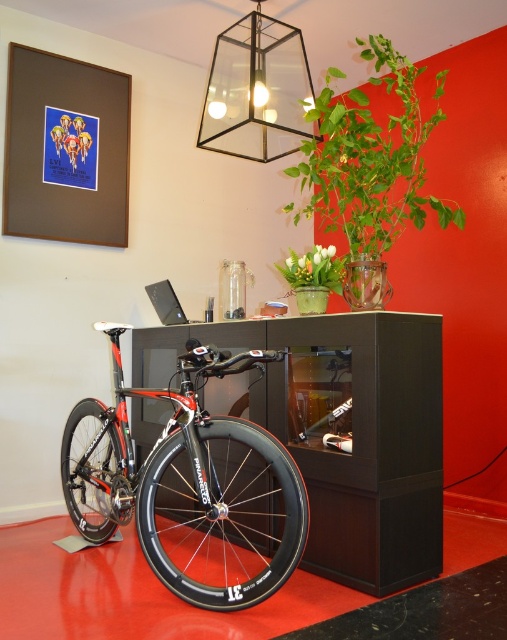
Question: Estimate the real-world distances between objects in this image. Which object is farther from the clear glass pendant light at upper center?

Choices:
 (A) satin black laptop at center
 (B) green matte vase at center
 (C) black carbon fiber wheel at center

Answer: (C)

Question: Does black carbon fiber wheel at center appear on the left side of green matte vase at center?

Choices:
 (A) no
 (B) yes

Answer: (B)

Question: Which object is farther from the camera taking this photo?

Choices:
 (A) green matte vase at center
 (B) clear glass pendant light at upper center
 (C) black matte wheel at lower left

Answer: (A)

Question: Does green leafy plant at upper right have a lesser width compared to black matte wheel at lower left?

Choices:
 (A) no
 (B) yes

Answer: (A)

Question: Does black carbon fiber wheel at center come in front of black matte wheel at lower left?

Choices:
 (A) no
 (B) yes

Answer: (B)

Question: Which point is farther from the camera taking this photo?

Choices:
 (A) (170, 298)
 (B) (89, 422)
 (C) (232, 42)

Answer: (B)